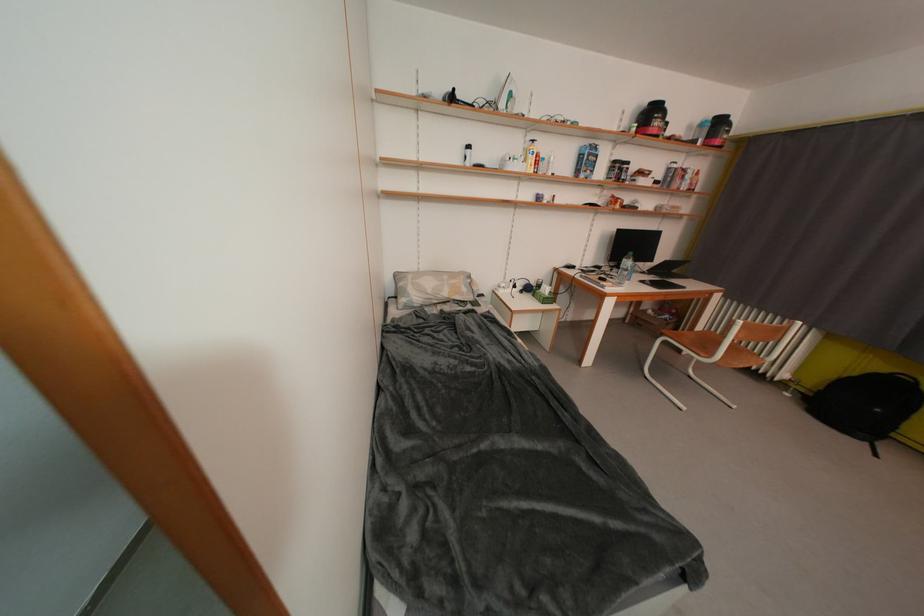
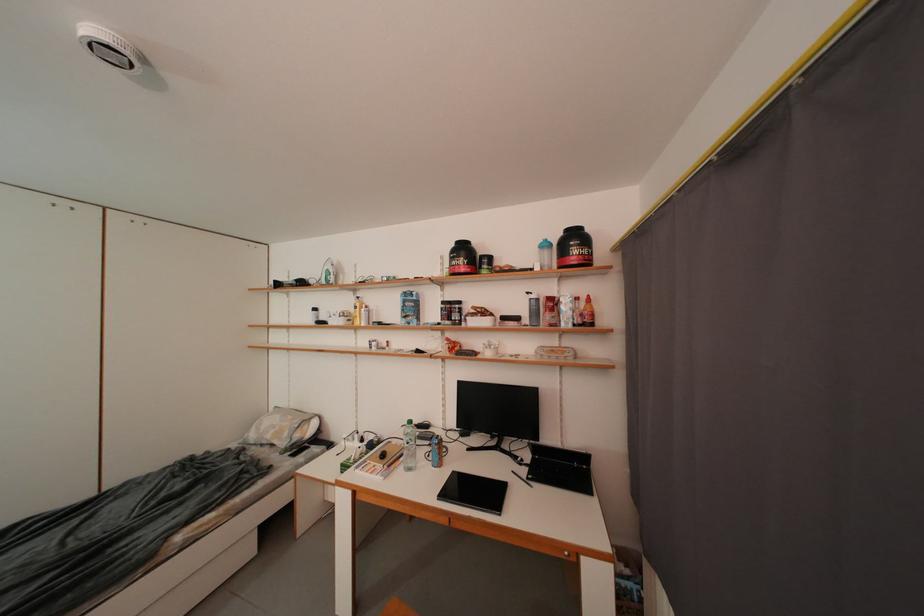
Find the pixel in the second image that matches the point at 471,293 in the first image.

(294, 438)